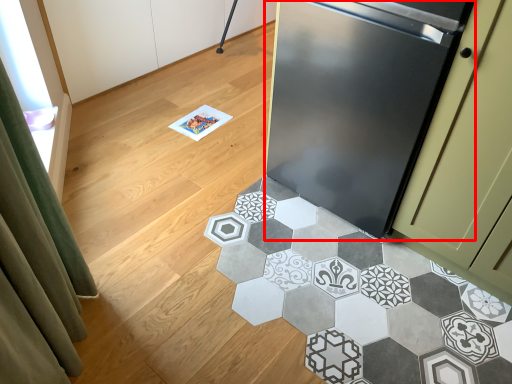
Question: From the image's perspective, what is the correct spatial positioning of refrigerator (annotated by the red box) in reference to marble?

Choices:
 (A) below
 (B) above

Answer: (B)